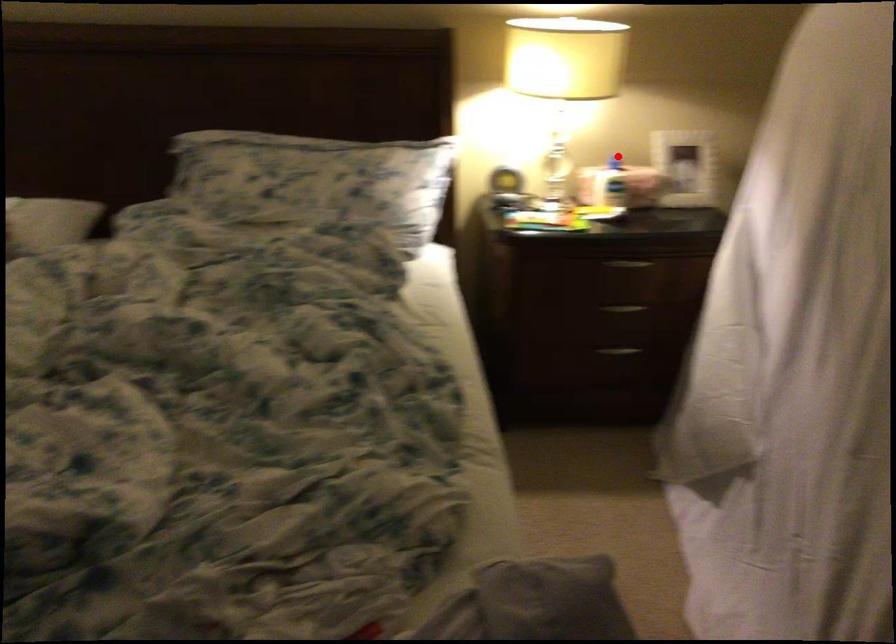
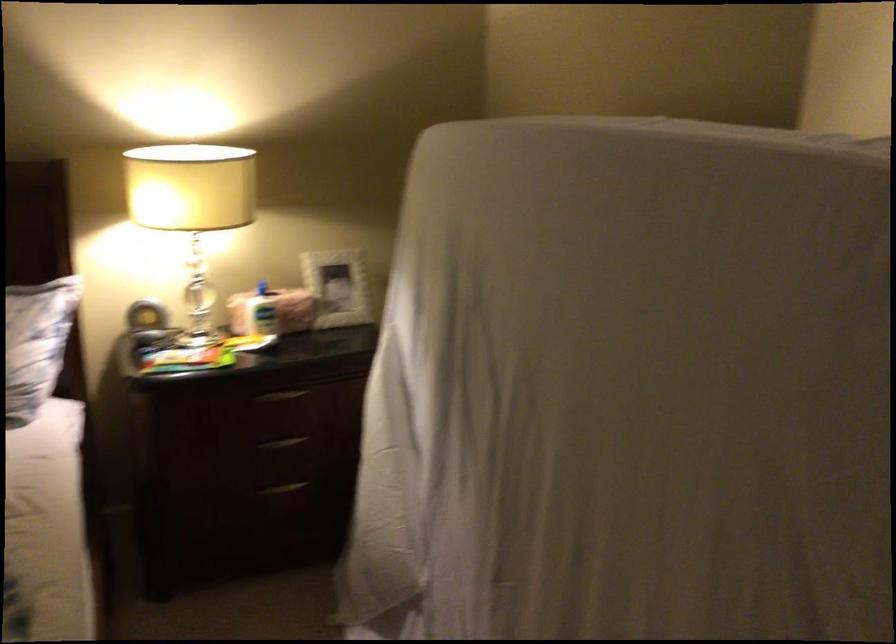
Question: I am providing you with two images of the same scene from different viewpoints. Given a red point in image1, look at the same physical point in image2. Is it:

Choices:
 (A) Closer to the viewpoint
 (B) Farther from the viewpoint

Answer: (A)